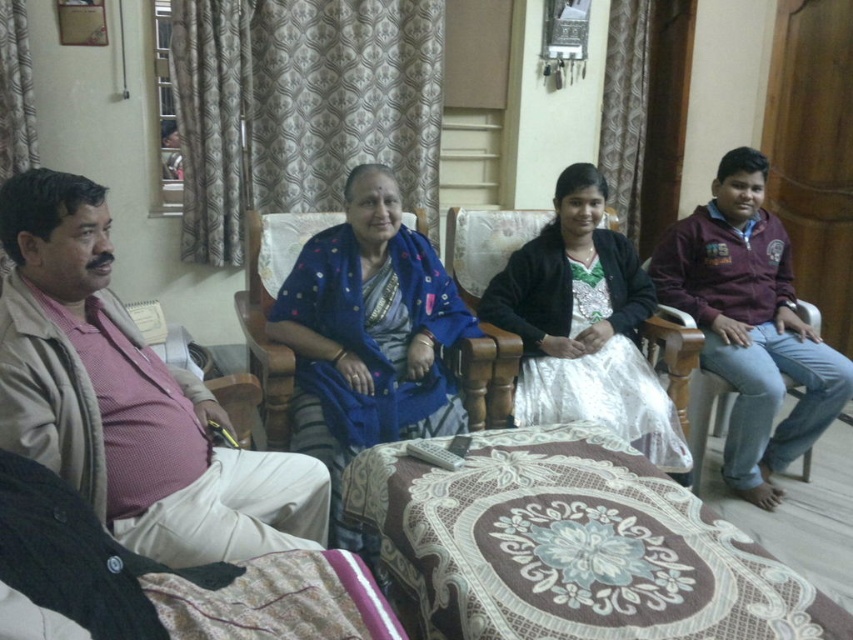
Question: Can you confirm if pink woven shirt at left is wider than silvery satin dress at center?

Choices:
 (A) yes
 (B) no

Answer: (B)

Question: Where is pink woven shirt at left located in relation to blue fabric armchair at center in the image?

Choices:
 (A) left
 (B) right

Answer: (A)

Question: Is beige cotton pants at left above blue fabric armchair at center?

Choices:
 (A) no
 (B) yes

Answer: (A)

Question: Based on their relative distances, which object is nearer to the pink woven shirt at left?

Choices:
 (A) beige cotton pants at left
 (B) matte brown wood armchair at right
 (C) silvery satin dress at center

Answer: (A)

Question: Which is farther from the beige cotton pants at left?

Choices:
 (A) silvery satin dress at center
 (B) matte brown wood armchair at right

Answer: (B)

Question: Among these points, which one is farthest from the camera?

Choices:
 (A) (664, 424)
 (B) (126, 410)
 (C) (645, 264)
 (D) (231, 600)

Answer: (C)